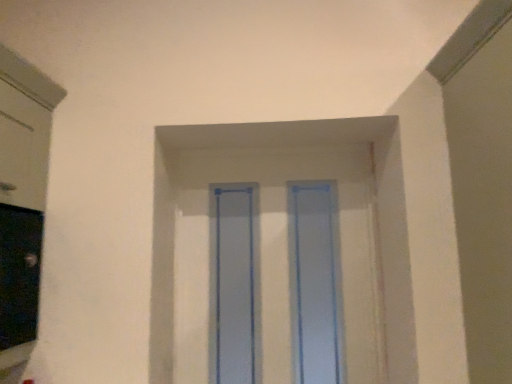
Question: Is point (334, 225) positioned closer to the camera than point (275, 177)?

Choices:
 (A) farther
 (B) closer

Answer: (B)

Question: From a real-world perspective, relative to transparent plastic window frame at center, is transparent plastic glass door at center vertically above or below?

Choices:
 (A) below
 (B) above

Answer: (B)

Question: In the image, is transparent plastic glass door at center positioned in front of or behind transparent plastic window frame at center?

Choices:
 (A) behind
 (B) front

Answer: (B)

Question: Is transparent plastic window frame at center inside the boundaries of transparent plastic glass door at center, or outside?

Choices:
 (A) inside
 (B) outside

Answer: (A)

Question: From their relative heights in the image, would you say transparent plastic window frame at center is taller or shorter than transparent plastic glass door at center?

Choices:
 (A) tall
 (B) short

Answer: (B)

Question: From the image's perspective, is transparent plastic window frame at center located above or below transparent plastic glass door at center?

Choices:
 (A) below
 (B) above

Answer: (A)

Question: From a real-world perspective, is transparent plastic window frame at center positioned above or below transparent plastic glass door at center?

Choices:
 (A) above
 (B) below

Answer: (B)